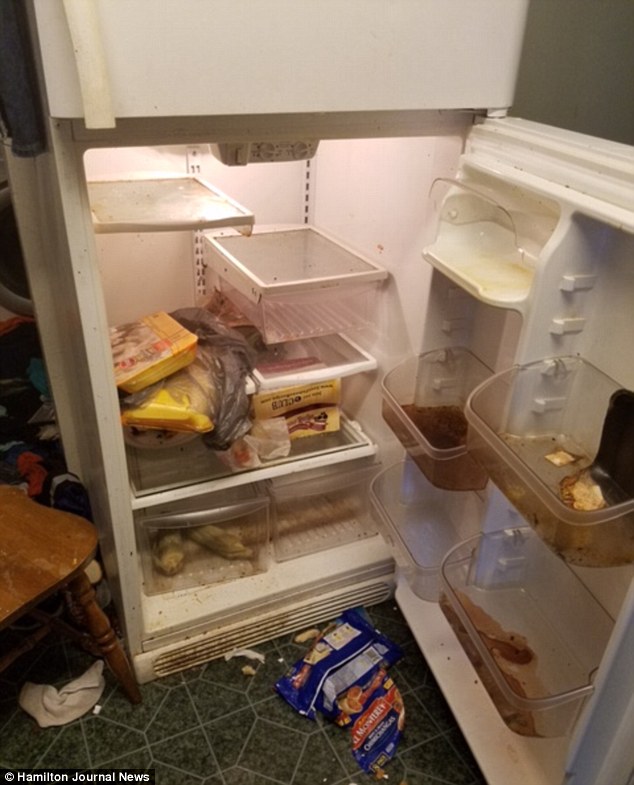
Generate point markers for all where you'd open freezer in the image. Your answer should be formatted as a list of tuples, i.e. [(x1, y1), (x2, y2), ...], where each tuple contains the x and y coordinates of a point satisfying the conditions above.

[(94, 57)]